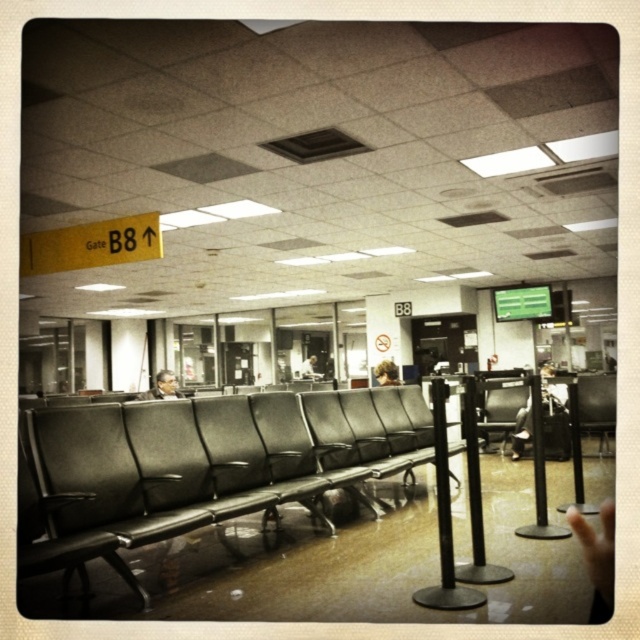
You are a maintenance worker at the airport and need to move a 4 meter long ladder from the storage area to the ceiling tiles near Gate B8. You have to pass between the matte black seats at center and the matte black chair at center. Will the ladder fit through the space between them?

The distance between the matte black seats at center and the matte black chair at center is 3.78 meters. Since the ladder is 4 meters long, it will not fit through the space between them as the ladder is longer than the available distance.

You are a wheelchair user who needs to reach the matte black seats at center from your current position. Given that your wheelchair has a turning radius of 0.8 meters, can you navigate to the seats without obstacles?

The distance between the matte black seats at center and the viewer is 2.92 meters. Since the wheelchair has a turning radius of 0.8 meters, which is sufficient to navigate towards the seats in a straight path, you can reach the matte black seats at center without issues.

You are standing at the airport gate B8 and want to locate two specific points marked in the scene. The first point is at coordinates point (376, 422) and the second is at point (499, 426). Which of these two points is closer to your current position?

Point (376, 422) is closer to the viewer than point (499, 426), so the first point is closer to your current position.